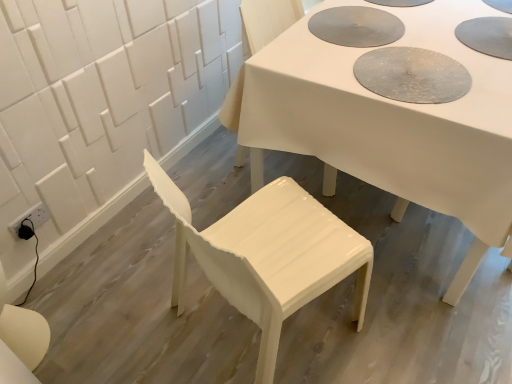
Question: From the image's perspective, is white glossy table at center above or below white glossy chair at center, which ranks as the first chair in top-to-bottom order?

Choices:
 (A) above
 (B) below

Answer: (A)

Question: In terms of width, does white glossy table at center look wider or thinner when compared to white glossy chair at center, which ranks as the first chair in top-to-bottom order?

Choices:
 (A) thin
 (B) wide

Answer: (B)

Question: Estimate the real-world distances between objects in this image. Which object is closer to the white glossy chair at center, the second chair in the front-to-back sequence?

Choices:
 (A) glossy white chair at lower center, the second chair viewed from the back
 (B) white glossy table at center

Answer: (B)

Question: Which is nearer to the white glossy chair at center, which ranks as the 1th chair in back-to-front order?

Choices:
 (A) glossy white chair at lower center, the second chair viewed from the back
 (B) white glossy table at center

Answer: (B)